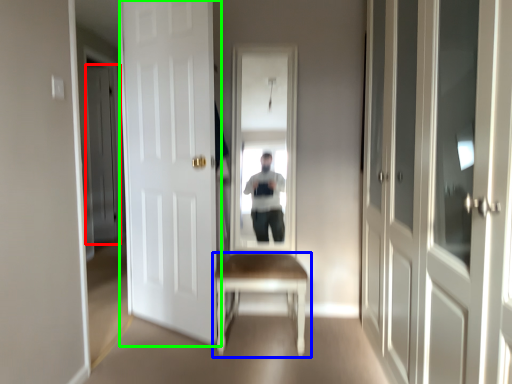
Question: Which object is the farthest from door (highlighted by a red box)? Choose among these: table (highlighted by a blue box) or door (highlighted by a green box).

Choices:
 (A) table
 (B) door

Answer: (A)